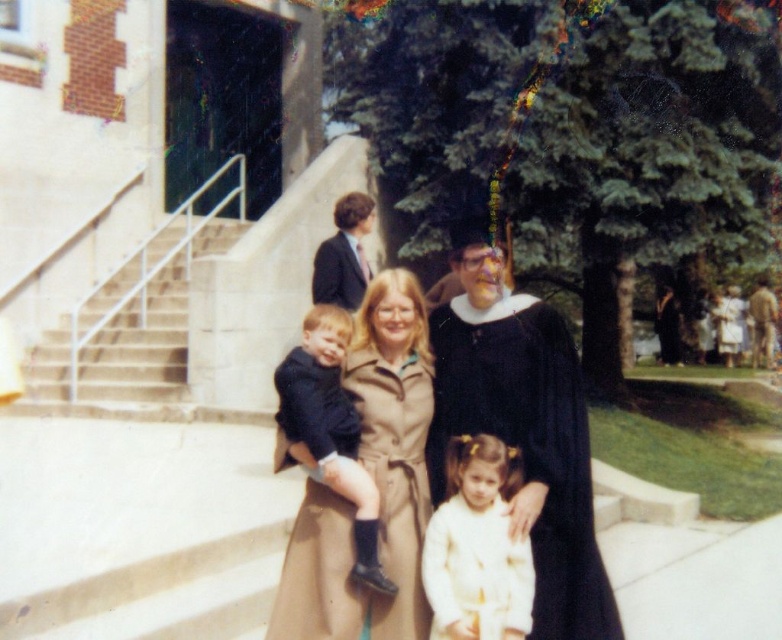
Question: Does black matte graduation gown at center have a greater width compared to white satin dress at center?

Choices:
 (A) no
 (B) yes

Answer: (B)

Question: Which point is farther to the camera?

Choices:
 (A) matte black graduation gown at center
 (B) black matte graduation gown at center

Answer: (A)

Question: Which point appears closest to the camera in this image?

Choices:
 (A) (335, 240)
 (B) (468, 550)
 (C) (231, 234)
 (D) (273, 634)

Answer: (B)

Question: Which point is closer to the camera?

Choices:
 (A) (345, 371)
 (B) (475, 461)

Answer: (B)

Question: Is black matte graduation gown at center above tan suede trench coat at center?

Choices:
 (A) no
 (B) yes

Answer: (B)

Question: Is tan suede trench coat at center to the left of matte black suit at upper center from the viewer's perspective?

Choices:
 (A) yes
 (B) no

Answer: (B)